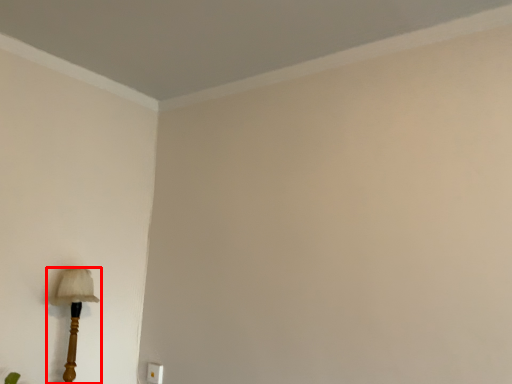
Question: From the image's perspective, what is the correct spatial positioning of lamp (annotated by the red box) in reference to electric outlet?

Choices:
 (A) below
 (B) above

Answer: (B)